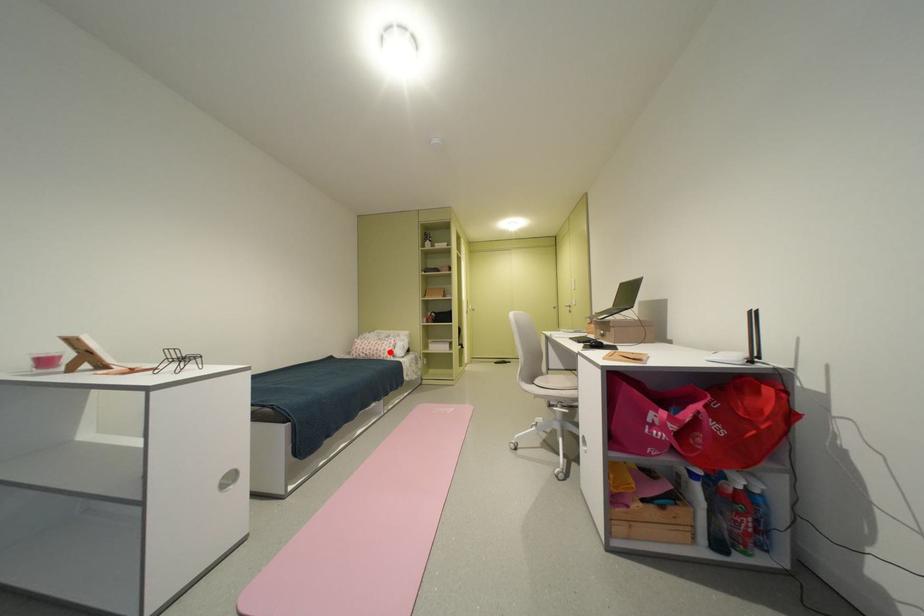
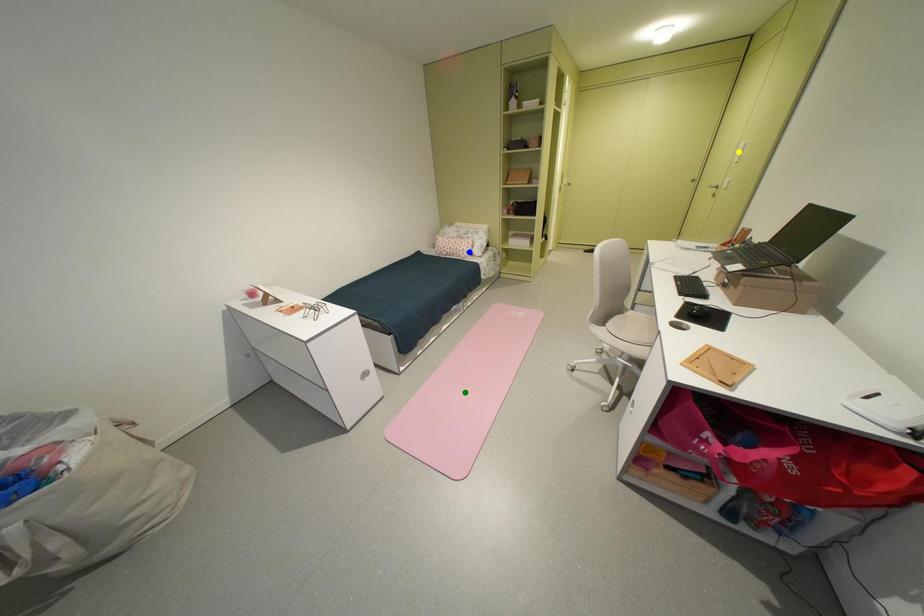
Question: I am providing you with two images of the same scene from different viewpoints. A red point is marked on the first image. You are given multiple points on the second image. Which point in image 2 represents the same 3d spot as the red point in image 1?

Choices:
 (A) blue point
 (B) green point
 (C) yellow point

Answer: (A)